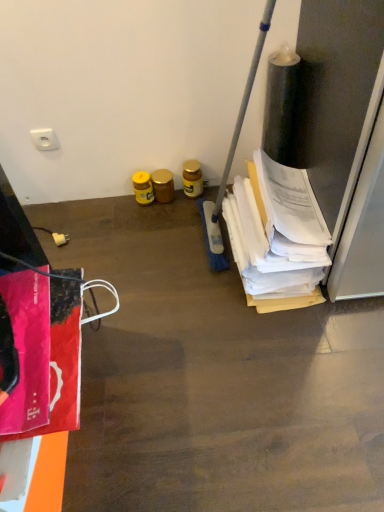
Question: Based on their sizes in the image, would you say white plastic socket at upper left, placed as the 2th power plugs and sockets when sorted from bottom to top, is bigger or smaller than white paper at right?

Choices:
 (A) big
 (B) small

Answer: (B)

Question: From the image's perspective, is white plastic socket at upper left, which is the 1th power plugs and sockets from top to bottom, positioned above or below white paper at right?

Choices:
 (A) above
 (B) below

Answer: (A)

Question: Estimate the real-world distances between objects in this image. Which object is farther from the yellow matte jar at center, the first bottle viewed from the right?

Choices:
 (A) white plastic socket at upper left, placed as the 2th power plugs and sockets when sorted from bottom to top
 (B) white plastic plug at lower left, the first power plugs and sockets in the bottom-to-top sequence
 (C) yellow glossy jar at center, which ranks as the first bottle in left-to-right order
 (D) gold metallic jar at center, positioned as the 2th bottle in left-to-right order
 (E) white paper at right

Answer: (B)

Question: Which is farther from the gold metallic jar at center, positioned as the 2th bottle in left-to-right order?

Choices:
 (A) yellow glossy jar at center, which ranks as the first bottle in left-to-right order
 (B) white plastic plug at lower left, the first power plugs and sockets in the bottom-to-top sequence
 (C) yellow matte jar at center, the 3th bottle viewed from the left
 (D) white paper at right
 (E) white plastic socket at upper left, placed as the 2th power plugs and sockets when sorted from bottom to top

Answer: (D)